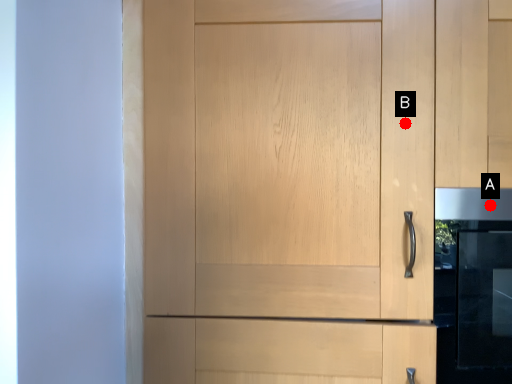
Question: Two points are circled on the image, labeled by A and B beside each circle. Which point is farther from the camera taking this photo?

Choices:
 (A) A is further
 (B) B is further

Answer: (A)